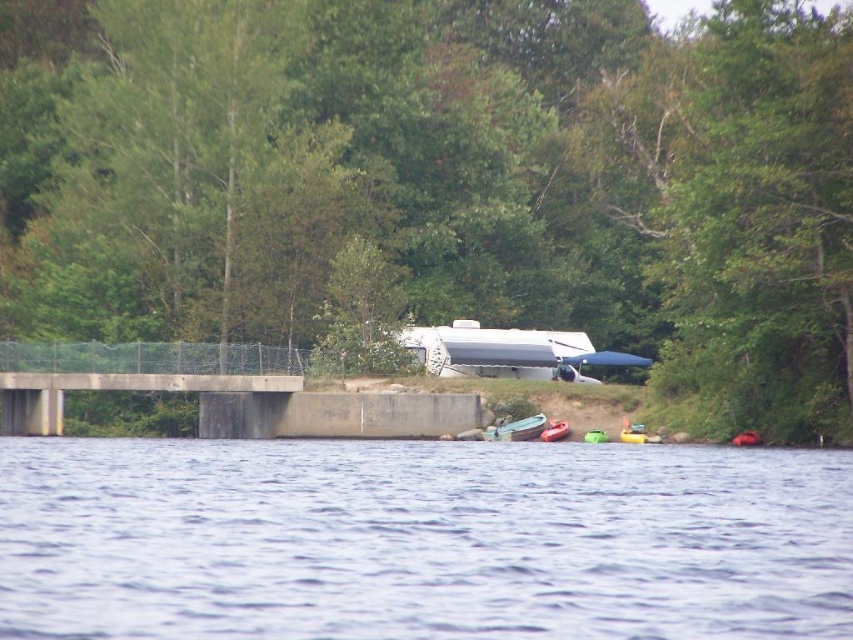
Question: Which object is closer to the camera taking this photo?

Choices:
 (A) metallic blue kayak at lower center
 (B) transparent water at center
 (C) green rubber boat at lower center

Answer: (B)

Question: Can you confirm if green leafy tree at upper center is positioned above green rubber boat at lower center?

Choices:
 (A) yes
 (B) no

Answer: (A)

Question: Is green leafy tree at upper center thinner than metallic blue kayak at lower center?

Choices:
 (A) no
 (B) yes

Answer: (A)

Question: Which object appears closest to the camera in this image?

Choices:
 (A) metallic blue kayak at lower center
 (B) green leafy tree at upper center
 (C) green rubber boat at lower center
 (D) transparent water at center

Answer: (D)

Question: Among these points, which one is farthest from the camera?

Choices:
 (A) (540, 424)
 (B) (552, 440)
 (C) (277, 157)
 (D) (314, 609)

Answer: (C)

Question: In this image, where is green leafy tree at upper center located relative to transparent water at center?

Choices:
 (A) above
 (B) below

Answer: (A)